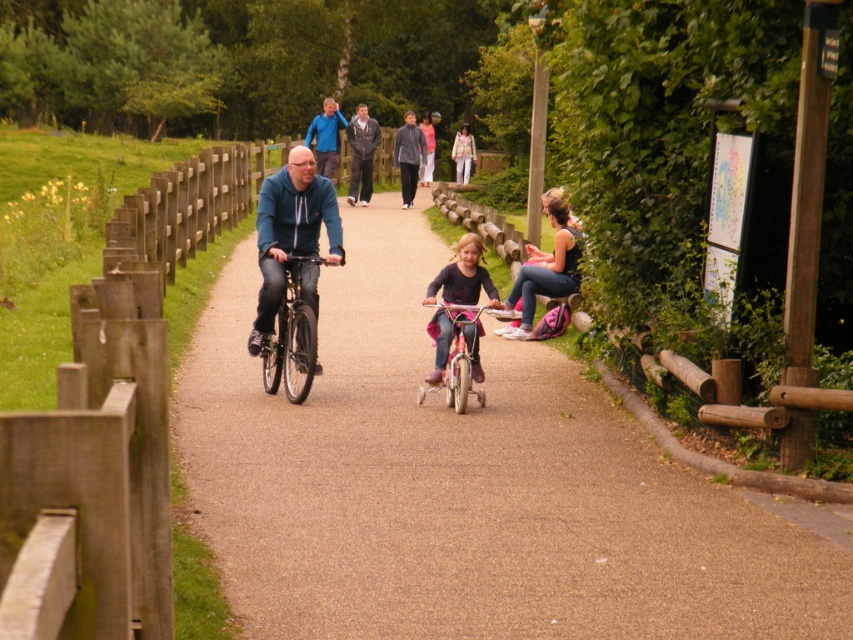
Question: Which object is farther from the camera taking this photo?

Choices:
 (A) pink matte bicycle at center
 (B) matte black tank top at center right
 (C) brown gravel path at center
 (D) matte pink bicycle at center

Answer: (B)

Question: Among these points, which one is farthest from the camera?

Choices:
 (A) (297, 273)
 (B) (297, 186)
 (C) (465, 131)

Answer: (C)

Question: Estimate the real-world distances between objects in this image. Which object is closer to the shiny metallic bicycle at center?

Choices:
 (A) pink matte bicycle at center
 (B) matte blue jacket at center
 (C) light beige fabric jacket at upper center
 (D) blue fabric jacket at upper center

Answer: (B)

Question: Can you confirm if matte black tank top at center right is positioned below dark gray sweater at center?

Choices:
 (A) no
 (B) yes

Answer: (B)

Question: Can you confirm if matte pink bicycle at center is positioned to the left of dark gray jacket at center?

Choices:
 (A) no
 (B) yes

Answer: (A)

Question: Does brown gravel path at center have a smaller size compared to blue fleece jacket at upper center?

Choices:
 (A) no
 (B) yes

Answer: (B)